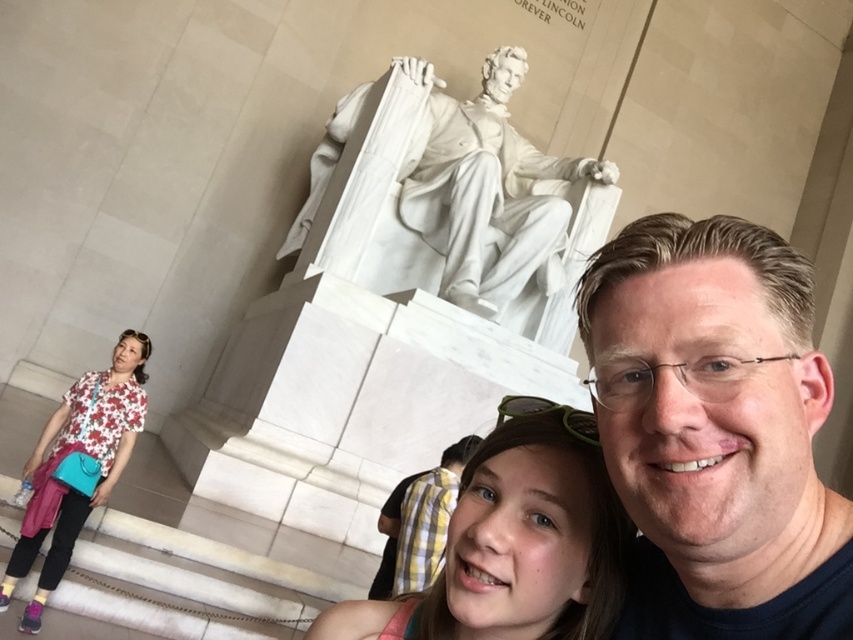
You are a photographer planning to capture a wide shot of the Lincoln Memorial scene. You have two subjects to include in the frame. The first is the white marble statue at center, and the second is the floral fabric shirt at lower center. Given their sizes, which subject should you focus on to ensure both are visible without cropping?

The white marble statue at center is larger than the floral fabric shirt at lower center, so focusing on the statue will ensure both subjects fit within the frame without cropping.

You are a photographer planning to capture a photo of the Lincoln Memorial. You notice the white marble statue at center and the floral fabric blouse at lower left in your frame. Which object should you focus on if you want to highlight the larger subject?

The white marble statue at center has a larger size compared to the floral fabric blouse at lower left, so you should focus on the white marble statue at center to highlight the larger subject.